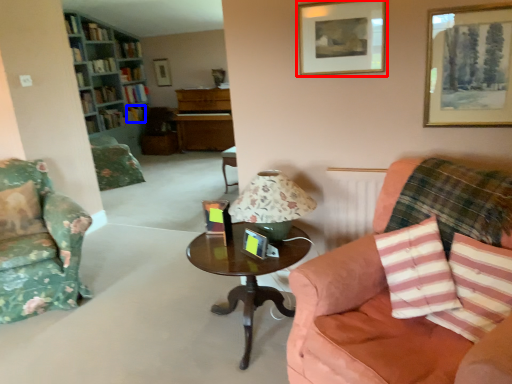
Question: Which object is closer to the camera taking this photo, picture frame (highlighted by a red box) or book (highlighted by a blue box)?

Choices:
 (A) picture frame
 (B) book

Answer: (A)